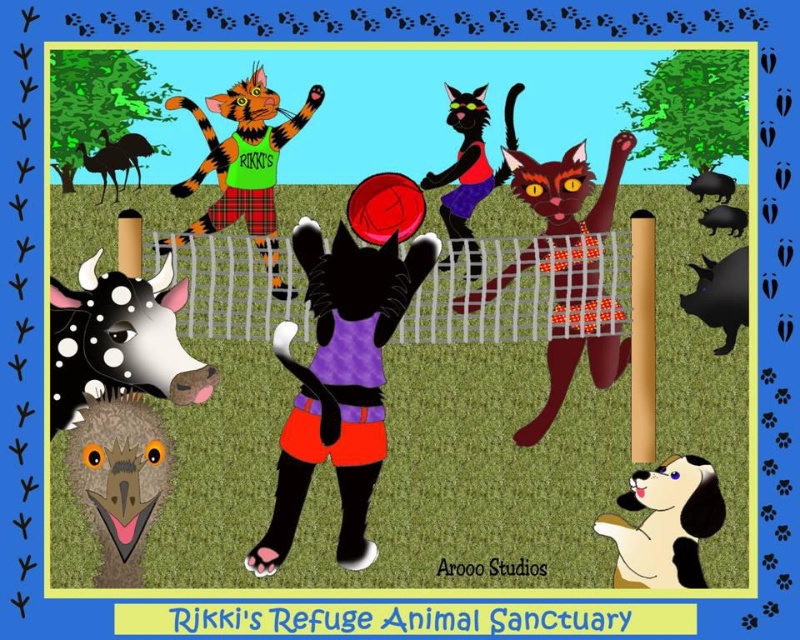
Question: Which point appears closest to the camera in this image?

Choices:
 (A) (112, 170)
 (B) (136, 150)

Answer: (B)

Question: Where is black fabric cat at center located in relation to brushed metal camel at upper left in the image?

Choices:
 (A) above
 (B) below

Answer: (A)

Question: Which point is closer to the camera?

Choices:
 (A) purple fabric cat at center
 (B) black fabric cat at center
 (C) orange plaid cat at center

Answer: (A)

Question: Does orange plaid cat at center appear on the left side of black and white plush dog at lower right?

Choices:
 (A) yes
 (B) no

Answer: (A)

Question: Which object is the closest to the orange plaid cat at center?

Choices:
 (A) black glossy pig at upper right
 (B) brown fuzzy head at lower left

Answer: (B)

Question: Is orange plaid cat at center to the right of black rubber pig at right from the viewer's perspective?

Choices:
 (A) yes
 (B) no

Answer: (B)